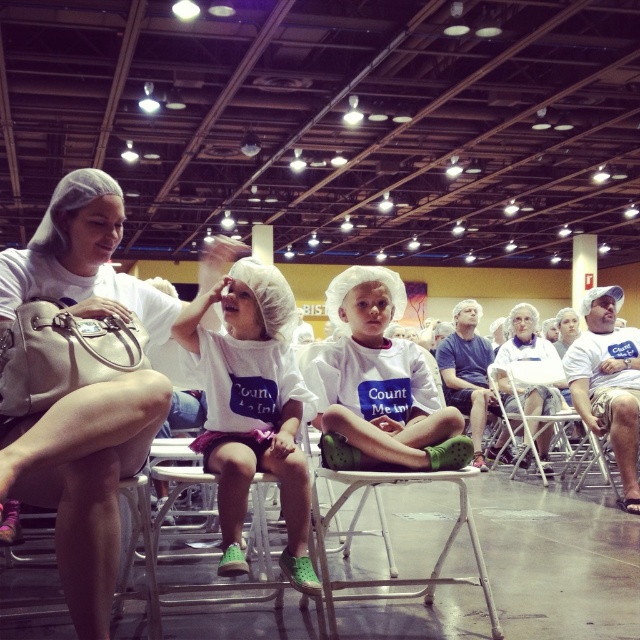
Between matte white hairnet at upper left and metallic silver folding chair at center, which one is positioned higher?

matte white hairnet at upper left is higher up.

Is point (99, 200) positioned after point (550, 376)?

No, (99, 200) is closer to viewer.

Which is in front, point (54, 250) or point (532, 429)?

Positioned in front is point (54, 250).

Where is `matte white hairnet at upper left`? Image resolution: width=640 pixels, height=640 pixels. matte white hairnet at upper left is located at coordinates (84, 477).